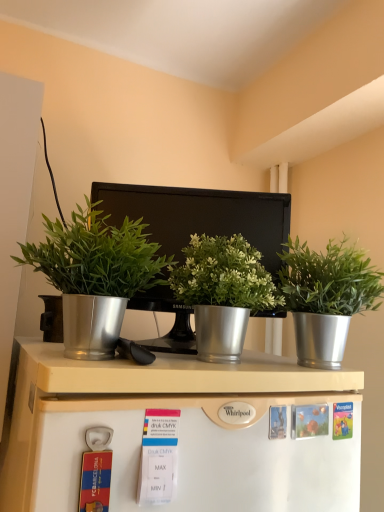
Describe the element at coordinates (326, 297) in the screenshot. I see `silver metallic plant pot at center, positioned as the 1th houseplant in right-to-left order` at that location.

How much space does silver metallic plant pot at center, which is the 3th houseplant in left-to-right order, occupy vertically?

The height of silver metallic plant pot at center, which is the 3th houseplant in left-to-right order, is 10.08 inches.

This screenshot has width=384, height=512. What do you see at coordinates (200, 215) in the screenshot?
I see `metallic silver monitor at center` at bounding box center [200, 215].

Image resolution: width=384 pixels, height=512 pixels. I want to click on white matte refrigerator at lower center, so click(180, 431).

In the scene shown: Is white matte refrigerator at lower center completely or partially inside metallic silver monitor at center?

No.

From the image's perspective, which object appears higher, metallic silver monitor at center or white matte refrigerator at lower center?

metallic silver monitor at center is shown above in the image.

Can you see metallic silver monitor at center touching white matte refrigerator at lower center?

No, metallic silver monitor at center is not making contact with white matte refrigerator at lower center.

From a real-world perspective, is metallic silver monitor at center physically above white matte refrigerator at lower center?

Indeed, from a real-world perspective, metallic silver monitor at center stands above white matte refrigerator at lower center.

Considering the positions of point (298, 403) and point (147, 252), is point (298, 403) closer or farther from the camera than point (147, 252)?

Point (298, 403) is farther from the camera than point (147, 252).

From a real-world perspective, between white matte refrigerator at lower center and metallic silver plant pot at left, positioned as the 1th houseplant in left-to-right order, who is vertically lower?

In real-world perspective, white matte refrigerator at lower center is lower.

Is white matte refrigerator at lower center wider than metallic silver plant pot at left, positioned as the 1th houseplant in left-to-right order?

Incorrect, the width of white matte refrigerator at lower center does not surpass that of metallic silver plant pot at left, positioned as the 1th houseplant in left-to-right order.

Identify the location of the 1st houseplant in front of the silver metallic plant pot at center, which is the 3th houseplant in left-to-right order. (223, 292).

Is silver metallic plant pot at center, which is the 3th houseplant in left-to-right order, turned away from metallic silver pot at center, the second houseplant in the right-to-left sequence?

That's not correct — silver metallic plant pot at center, which is the 3th houseplant in left-to-right order, is not looking away from metallic silver pot at center, the second houseplant in the right-to-left sequence.

From the picture: Is silver metallic plant pot at center, positioned as the 1th houseplant in right-to-left order, in contact with metallic silver pot at center, which is the 2th houseplant from left to right?

silver metallic plant pot at center, positioned as the 1th houseplant in right-to-left order, and metallic silver pot at center, which is the 2th houseplant from left to right, are clearly separated.

Is point (302, 298) more distant than point (247, 324)?

No, it is in front of (247, 324).

Between silver metallic plant pot at center, which is the 3th houseplant in left-to-right order, and metallic silver plant pot at left, positioned as the third houseplant in right-to-left order, which one is positioned in front?

metallic silver plant pot at left, positioned as the third houseplant in right-to-left order.

In the scene shown: Can you tell me how much silver metallic plant pot at center, which is the 3th houseplant in left-to-right order, and metallic silver plant pot at left, positioned as the 1th houseplant in left-to-right order, differ in facing direction?

They differ by 5.12 degrees in their facing directions.

Does silver metallic plant pot at center, which is the 3th houseplant in left-to-right order, turn towards metallic silver plant pot at left, positioned as the third houseplant in right-to-left order?

No, silver metallic plant pot at center, which is the 3th houseplant in left-to-right order, is not facing towards metallic silver plant pot at left, positioned as the third houseplant in right-to-left order.

In terms of width, does silver metallic plant pot at center, which is the 3th houseplant in left-to-right order, look wider or thinner when compared to metallic silver plant pot at left, positioned as the 1th houseplant in left-to-right order?

In the image, silver metallic plant pot at center, which is the 3th houseplant in left-to-right order, appears to be wider than metallic silver plant pot at left, positioned as the 1th houseplant in left-to-right order.

Is silver metallic plant pot at center, positioned as the 1th houseplant in right-to-left order, a part of white matte refrigerator at lower center?

Definitely not — silver metallic plant pot at center, positioned as the 1th houseplant in right-to-left order, is not inside white matte refrigerator at lower center.

Considering the points (251, 428) and (330, 252), which point is behind, point (251, 428) or point (330, 252)?

The point (330, 252) is farther from the camera.

Is white matte refrigerator at lower center further to camera compared to silver metallic plant pot at center, positioned as the 1th houseplant in right-to-left order?

No, the depth of white matte refrigerator at lower center is less than that of silver metallic plant pot at center, positioned as the 1th houseplant in right-to-left order.

Could you tell me if metallic silver monitor at center is facing metallic silver pot at center, which is the 2th houseplant from left to right?

Yes, metallic silver monitor at center is turned towards metallic silver pot at center, which is the 2th houseplant from left to right.

From a real-world perspective, is metallic silver monitor at center positioned under metallic silver pot at center, which is the 2th houseplant from left to right, based on gravity?

No, from a real-world perspective, metallic silver monitor at center is not beneath metallic silver pot at center, which is the 2th houseplant from left to right.

Which object is positioned more to the left, metallic silver monitor at center or metallic silver pot at center, which is the 2th houseplant from left to right?

metallic silver monitor at center is more to the left.

Can you tell me how much metallic silver monitor at center and metallic silver pot at center, which is the 2th houseplant from left to right, differ in facing direction?

metallic silver monitor at center and metallic silver pot at center, which is the 2th houseplant from left to right, are facing 27 degrees away from each other.

Can you tell me how much metallic silver monitor at center and silver metallic plant pot at center, which is the 3th houseplant in left-to-right order, differ in facing direction?

21.8 degrees.

In the scene shown: From a real-world perspective, is metallic silver monitor at center above or below silver metallic plant pot at center, positioned as the 1th houseplant in right-to-left order?

Clearly, from a real-world perspective, metallic silver monitor at center is above silver metallic plant pot at center, positioned as the 1th houseplant in right-to-left order.

Locate an element on the screen. houseplant that is the 2nd object to the right of the metallic silver monitor at center, starting at the anchor is located at coordinates (326, 297).

Who is bigger, metallic silver monitor at center or silver metallic plant pot at center, which is the 3th houseplant in left-to-right order?

metallic silver monitor at center.

Locate an element on the screen. appliance above the white matte refrigerator at lower center (from a real-world perspective) is located at coordinates (200, 215).

At what (x,y) coordinates should I click in order to perform the action: click on the 1st houseplant behind the white matte refrigerator at lower center, starting your count from the anchor. Please return your answer as a coordinate pair (x, y). Looking at the image, I should click on (96, 278).

Considering their positions, is white matte refrigerator at lower center positioned further to metallic silver plant pot at left, positioned as the third houseplant in right-to-left order, than silver metallic plant pot at center, which is the 3th houseplant in left-to-right order?

The object further to metallic silver plant pot at left, positioned as the third houseplant in right-to-left order, is silver metallic plant pot at center, which is the 3th houseplant in left-to-right order.

Looking at the image, which one is located further to metallic silver monitor at center, metallic silver pot at center, the second houseplant in the right-to-left sequence, or silver metallic plant pot at center, positioned as the 1th houseplant in right-to-left order?

silver metallic plant pot at center, positioned as the 1th houseplant in right-to-left order, lies further to metallic silver monitor at center than the other object.

Which object lies nearer to the anchor point silver metallic plant pot at center, positioned as the 1th houseplant in right-to-left order, metallic silver pot at center, the second houseplant in the right-to-left sequence, or white matte refrigerator at lower center?

The object closer to silver metallic plant pot at center, positioned as the 1th houseplant in right-to-left order, is metallic silver pot at center, the second houseplant in the right-to-left sequence.

Estimate the real-world distances between objects in this image. Which object is closer to metallic silver pot at center, the second houseplant in the right-to-left sequence, metallic silver monitor at center or metallic silver plant pot at left, positioned as the third houseplant in right-to-left order?

The object closer to metallic silver pot at center, the second houseplant in the right-to-left sequence, is metallic silver plant pot at left, positioned as the third houseplant in right-to-left order.

From the picture: Estimate the real-world distances between objects in this image. Which object is further from white matte refrigerator at lower center, silver metallic plant pot at center, which is the 3th houseplant in left-to-right order, or metallic silver plant pot at left, positioned as the third houseplant in right-to-left order?

silver metallic plant pot at center, which is the 3th houseplant in left-to-right order.

Considering their positions, is silver metallic plant pot at center, positioned as the 1th houseplant in right-to-left order, positioned further to metallic silver monitor at center than metallic silver plant pot at left, positioned as the third houseplant in right-to-left order?

silver metallic plant pot at center, positioned as the 1th houseplant in right-to-left order.

From the image, which object appears to be farther from metallic silver pot at center, which is the 2th houseplant from left to right, metallic silver monitor at center or white matte refrigerator at lower center?

The object further to metallic silver pot at center, which is the 2th houseplant from left to right, is white matte refrigerator at lower center.

When comparing their distances from silver metallic plant pot at center, which is the 3th houseplant in left-to-right order, does white matte refrigerator at lower center or metallic silver monitor at center seem further?

Among the two, white matte refrigerator at lower center is located further to silver metallic plant pot at center, which is the 3th houseplant in left-to-right order.

I want to click on houseplant situated between metallic silver plant pot at left, positioned as the 1th houseplant in left-to-right order, and silver metallic plant pot at center, positioned as the 1th houseplant in right-to-left order, from left to right, so click(223, 292).

Identify the location of houseplant that lies between silver metallic plant pot at center, positioned as the 1th houseplant in right-to-left order, and white matte refrigerator at lower center from top to bottom. (223, 292).

The height and width of the screenshot is (512, 384). I want to click on houseplant between metallic silver pot at center, the second houseplant in the right-to-left sequence, and metallic silver monitor at center from front to back, so tap(326, 297).

Identify the location of appliance between metallic silver plant pot at left, positioned as the 1th houseplant in left-to-right order, and silver metallic plant pot at center, positioned as the 1th houseplant in right-to-left order, in the horizontal direction. This screenshot has height=512, width=384. (200, 215).